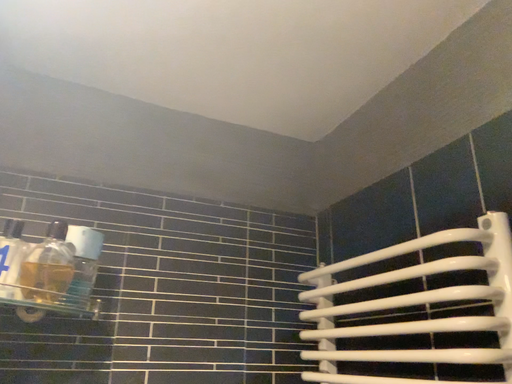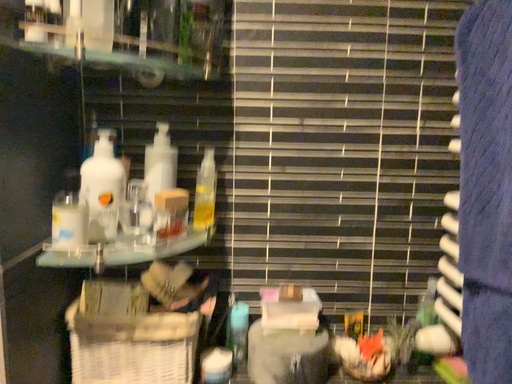
Question: Which way did the camera rotate in the video?

Choices:
 (A) rotated upward
 (B) rotated downward

Answer: (B)